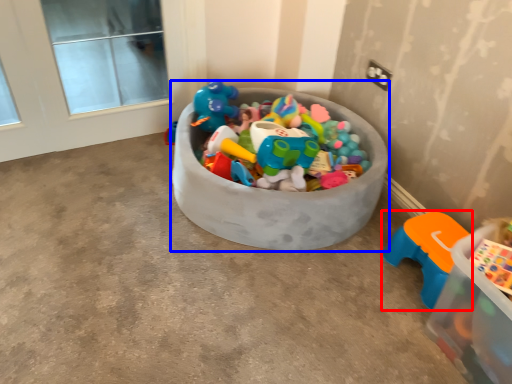
Question: Among these objects, which one is nearest to the camera, toy (highlighted by a red box) or storage box (highlighted by a blue box)?

Choices:
 (A) toy
 (B) storage box

Answer: (B)